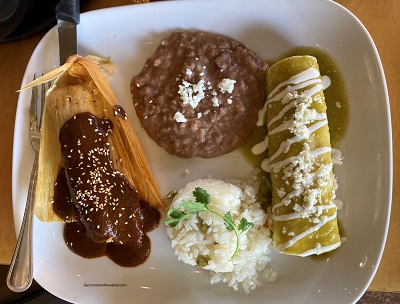
Find the location of `silver fork on left side edge of place`. silver fork on left side edge of place is located at coordinates tap(23, 256).